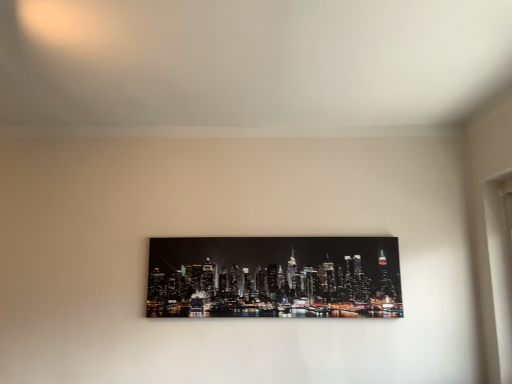
Question: Should I look upward or downward to see metallic cityscape print at center?

Choices:
 (A) down
 (B) up

Answer: (A)